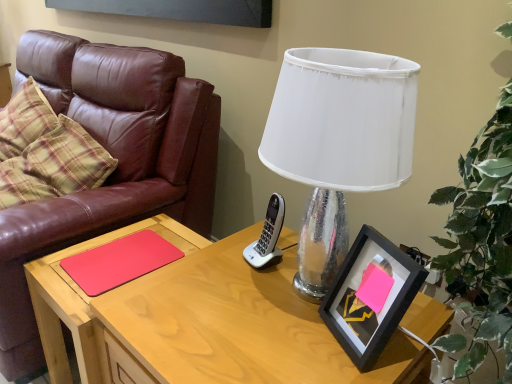
This screenshot has width=512, height=384. I want to click on vacant space underneath white fabric lampshade at upper center (from a real-world perspective), so click(283, 284).